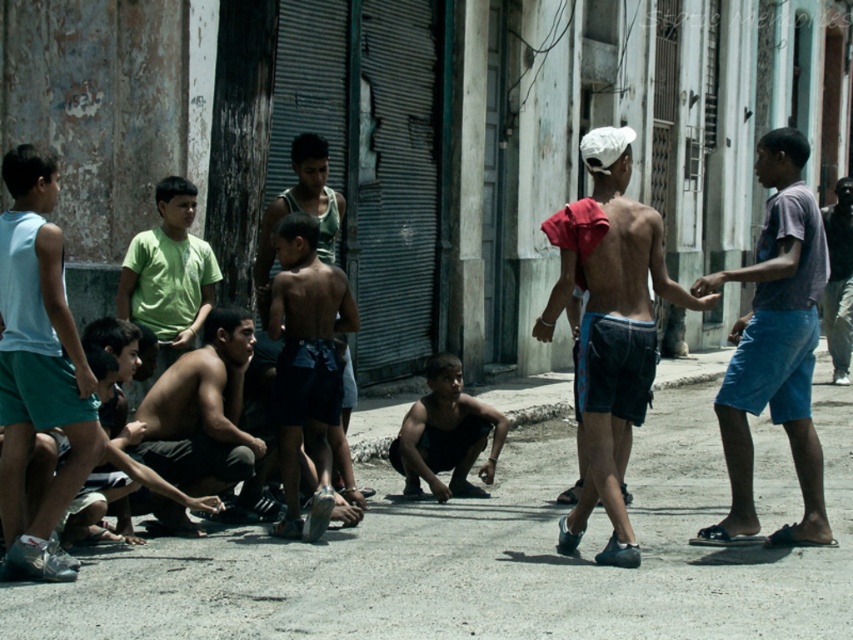
Looking at this image, is gray-blue cotton shirt at right shorter than dark blue jeans at center?

Yes.

The image size is (853, 640). In order to click on gray-blue cotton shirt at right in this screenshot , I will do `click(775, 348)`.

In the scene shown: Can you confirm if black matte shirt at center is wider than dark blue jeans at center?

Correct, the width of black matte shirt at center exceeds that of dark blue jeans at center.

Which is behind, point (463, 419) or point (843, 276)?

The point (843, 276) is behind.

This screenshot has height=640, width=853. Find the location of `black matte shirt at center`. black matte shirt at center is located at coordinates (445, 435).

Is shiny blue shorts at center to the right of black matte shirt at center from the viewer's perspective?

Yes, shiny blue shorts at center is to the right of black matte shirt at center.

Which is in front, point (614, 163) or point (404, 428)?

Point (614, 163) is more forward.

This screenshot has width=853, height=640. What do you see at coordinates (608, 326) in the screenshot?
I see `shiny blue shorts at center` at bounding box center [608, 326].

Identify the location of shiny blue shorts at center. (608, 326).